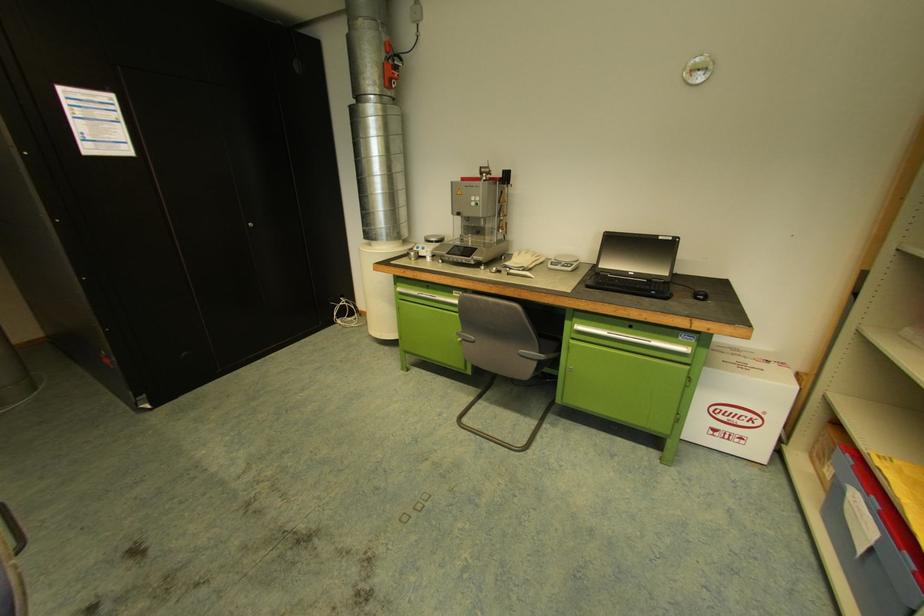
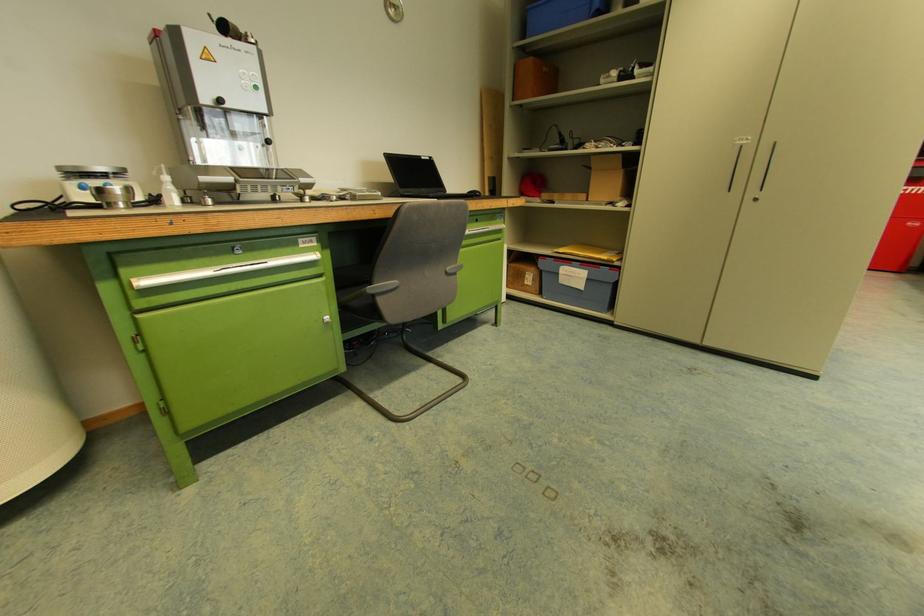
Locate, in the second image, the point that corresponds to pixel 477 338 in the first image.

(399, 282)